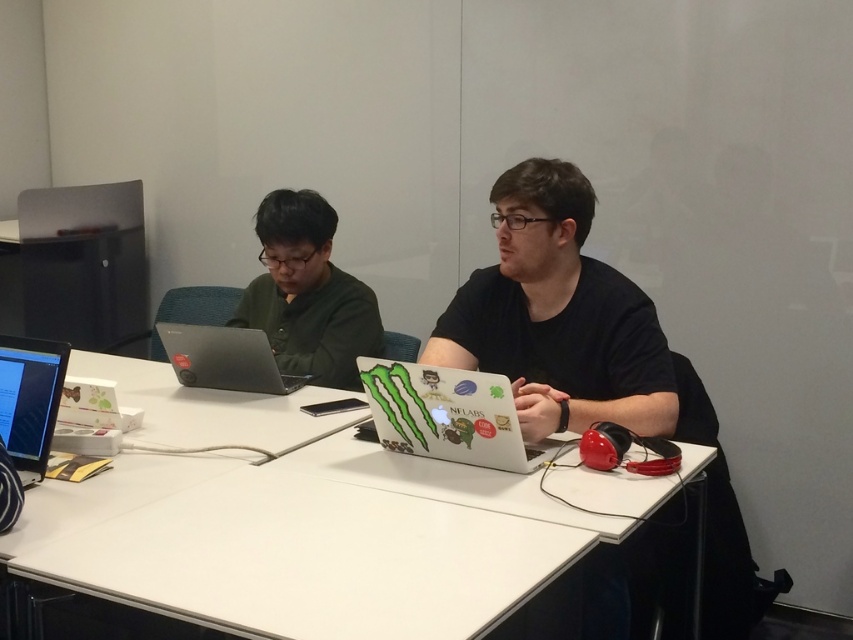
Question: Which object is closer to the camera taking this photo?

Choices:
 (A) silver metallic laptop at center
 (B) green matte laptop at center

Answer: (A)

Question: Can you confirm if white glossy laptop at center is positioned to the right of silver metallic laptop at center?

Choices:
 (A) no
 (B) yes

Answer: (B)

Question: Does white glossy laptop at center appear under black glossy laptop at lower left?

Choices:
 (A) no
 (B) yes

Answer: (B)

Question: Among these points, which one is nearest to the camera?

Choices:
 (A) (171, 332)
 (B) (352, 374)
 (C) (456, 381)
 (D) (148, 497)

Answer: (D)

Question: Estimate the real-world distances between objects in this image. Which object is farther from the black matte shirt at center?

Choices:
 (A) silver metallic laptop at center
 (B) white glossy laptop at center
 (C) white matte table at center

Answer: (A)

Question: Observing the image, what is the correct spatial positioning of white matte table at center in reference to silver metallic laptop at center?

Choices:
 (A) below
 (B) above

Answer: (A)